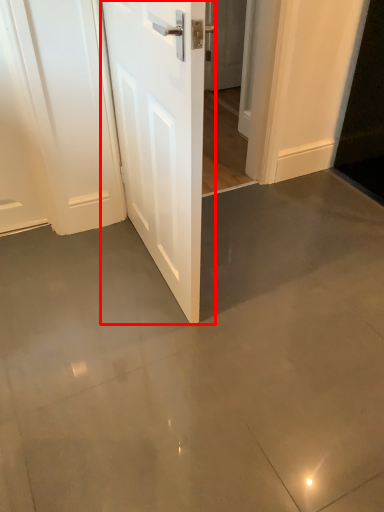
Question: From the image's perspective, where is door (annotated by the red box) located relative to door?

Choices:
 (A) above
 (B) below

Answer: (B)